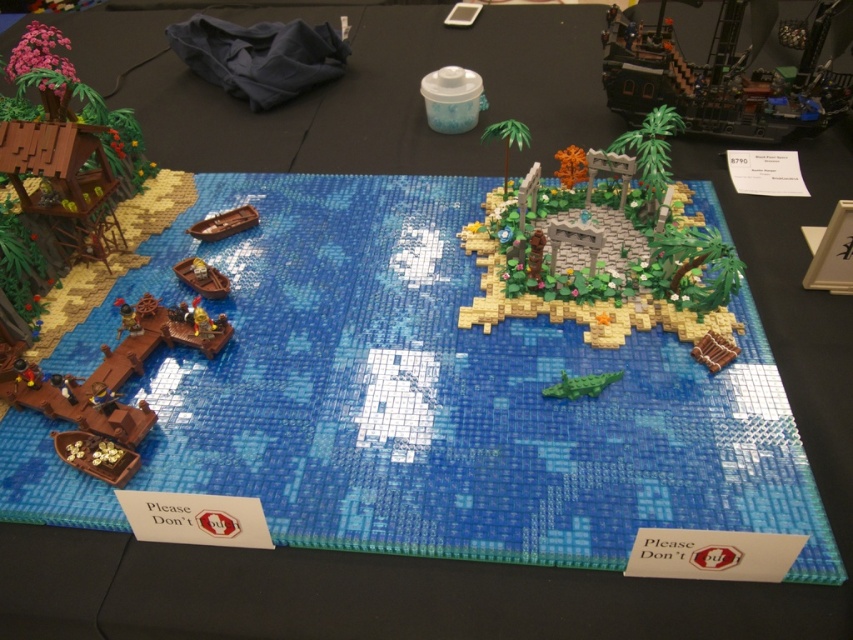
Does blue mosaic tile at center have a greater width compared to brown matte boat at center-left?

Yes.

Is blue mosaic tile at center further to the viewer compared to brown matte boat at center-left?

No.

Locate an element on the screen. This screenshot has width=853, height=640. blue mosaic tile at center is located at coordinates (442, 394).

This screenshot has width=853, height=640. What are the coordinates of `blue mosaic tile at center` in the screenshot? It's located at (442, 394).

Is brown matte boat at upper left positioned in front of green matte crocodile at center?

That is False.

Can you confirm if brown matte boat at upper left is taller than green matte crocodile at center?

Correct, brown matte boat at upper left is much taller as green matte crocodile at center.

The image size is (853, 640). What do you see at coordinates (224, 224) in the screenshot?
I see `brown matte boat at upper left` at bounding box center [224, 224].

Find the location of a particular element. The height and width of the screenshot is (640, 853). brown matte boat at upper left is located at coordinates (224, 224).

Which of these two, blue mosaic tile at center or dark brown wooden pirate ship at upper right, stands taller?

With more height is blue mosaic tile at center.

What do you see at coordinates (442, 394) in the screenshot? The height and width of the screenshot is (640, 853). I see `blue mosaic tile at center` at bounding box center [442, 394].

Image resolution: width=853 pixels, height=640 pixels. Identify the location of blue mosaic tile at center. (442, 394).